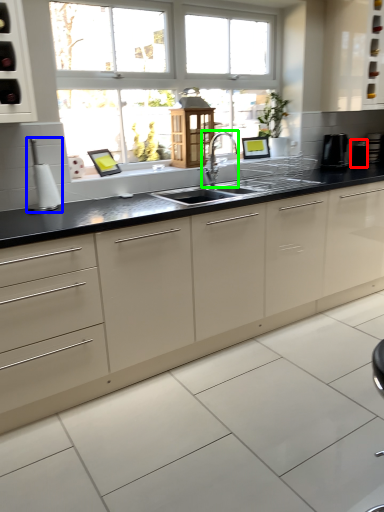
Question: Estimate the real-world distances between objects in this image. Which object is closer to appliance (highlighted by a red box), appliance (highlighted by a blue box) or tap (highlighted by a green box)?

Choices:
 (A) appliance
 (B) tap

Answer: (B)